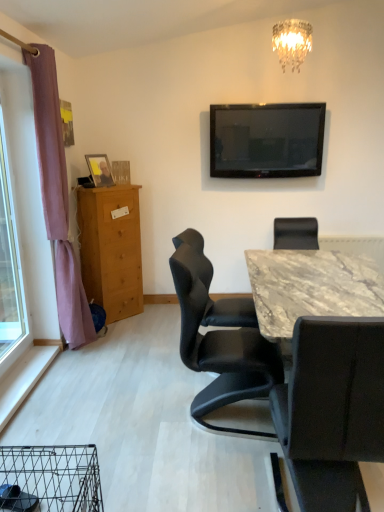
Question: In the image, is black leather chair at center, arranged as the second chair when viewed from the right, on the left side or the right side of purple fabric curtain at left?

Choices:
 (A) left
 (B) right

Answer: (B)

Question: From their relative heights in the image, would you say black leather chair at center, which is the 1th chair from left to right, is taller or shorter than purple fabric curtain at left?

Choices:
 (A) tall
 (B) short

Answer: (B)

Question: Estimate the real-world distances between objects in this image. Which object is farther from the light brown wooden chest of drawers at left?

Choices:
 (A) purple fabric curtain at left
 (B) black leather chair at center, arranged as the second chair when viewed from the right
 (C) transparent glass window at left
 (D) wooden photo frame at left
 (E) flat-screen tv at upper center

Answer: (B)

Question: Considering the real-world distances, which object is closest to the black leather chair at center, positioned as the 1th chair in right-to-left order?

Choices:
 (A) black leather chair at center, which is the 1th chair from left to right
 (B) wooden photo frame at left
 (C) purple fabric curtain at left
 (D) flat-screen tv at upper center
 (E) transparent glass window at left

Answer: (A)